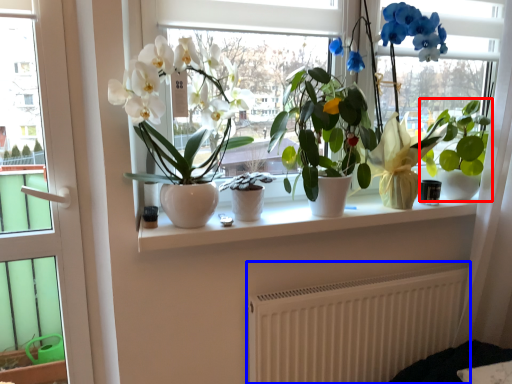
Question: Which object is further to the camera taking this photo, houseplant (highlighted by a red box) or radiator (highlighted by a blue box)?

Choices:
 (A) houseplant
 (B) radiator

Answer: (A)